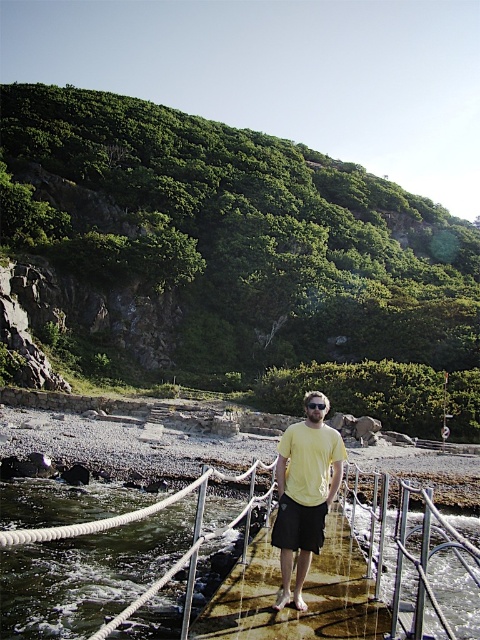
Which of these two, greenish-brown water at center or yellow matte t-shirt at center, stands taller?

greenish-brown water at center is taller.

Identify the location of greenish-brown water at center. The width and height of the screenshot is (480, 640). (404, 547).

Where is `greenish-brown water at center`? greenish-brown water at center is located at coordinates (404, 547).